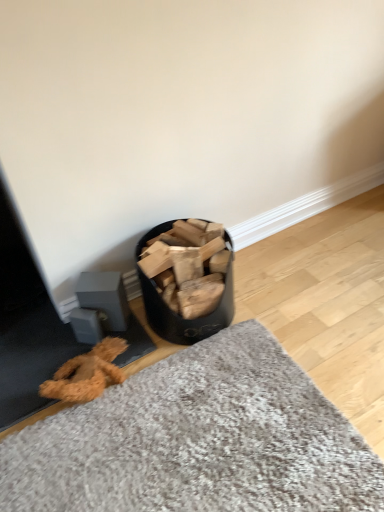
Question: In terms of width, does textured gray mat at lower center look wider or thinner when compared to black matte wood at center?

Choices:
 (A) thin
 (B) wide

Answer: (B)

Question: From a real-world perspective, is textured gray mat at lower center positioned above or below black matte wood at center?

Choices:
 (A) below
 (B) above

Answer: (A)

Question: From the image's perspective, is textured gray mat at lower center above or below black matte wood at center?

Choices:
 (A) above
 (B) below

Answer: (B)

Question: Is black matte wood at center taller or shorter than textured gray mat at lower center?

Choices:
 (A) short
 (B) tall

Answer: (B)

Question: Is black matte wood at center inside or outside of textured gray mat at lower center?

Choices:
 (A) outside
 (B) inside

Answer: (A)

Question: Considering the positions of point (153, 292) and point (77, 442), is point (153, 292) closer or farther from the camera than point (77, 442)?

Choices:
 (A) farther
 (B) closer

Answer: (A)

Question: In terms of width, does black matte wood at center look wider or thinner when compared to textured gray mat at lower center?

Choices:
 (A) thin
 (B) wide

Answer: (A)